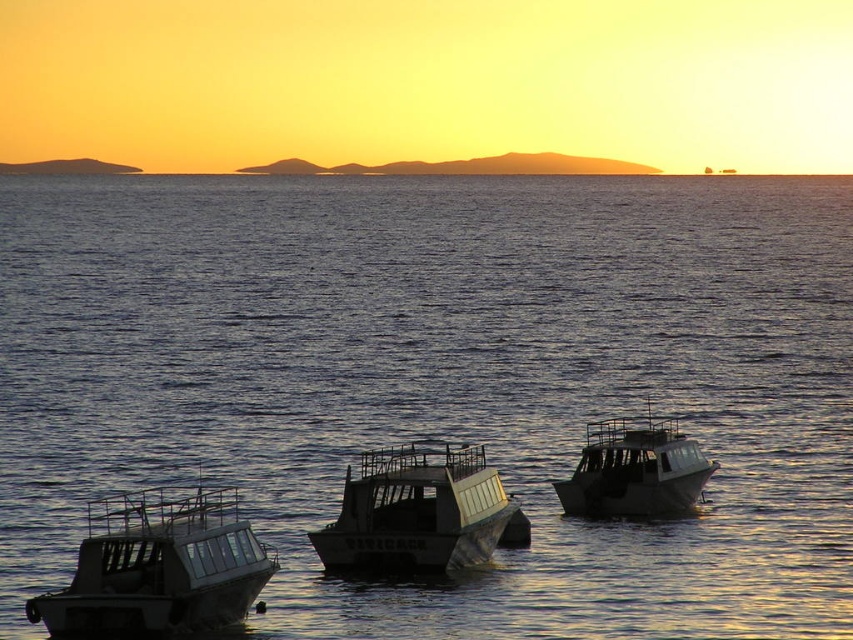
Is point (209, 627) closer to camera compared to point (387, 486)?

Yes, it is.

Between point (160, 624) and point (494, 468), which one is positioned in front?

Point (160, 624)

Locate an element on the screen. metallic gray boat at lower left is located at coordinates (160, 566).

Who is taller, dark blue water at center or metallic gray boat at right?

dark blue water at center

Identify the location of dark blue water at center. (440, 381).

Find the location of a particular element. metallic gray boat at center is located at coordinates (421, 512).

Can you confirm if metallic gray boat at center is thinner than metallic gray boat at right?

Yes, metallic gray boat at center is thinner than metallic gray boat at right.

This screenshot has height=640, width=853. I want to click on metallic gray boat at center, so click(421, 512).